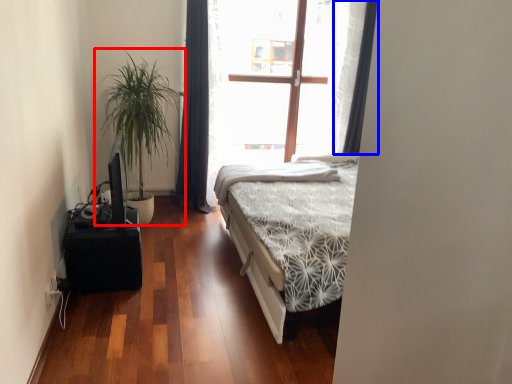
Question: Which point is further to the camera, houseplant (highlighted by a red box) or curtain (highlighted by a blue box)?

Choices:
 (A) houseplant
 (B) curtain

Answer: (B)